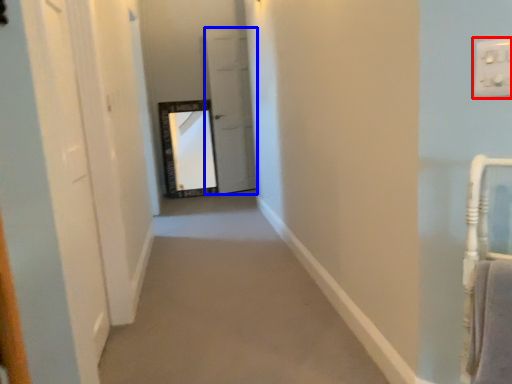
Question: Among these objects, which one is farthest to the camera, electric outlet (highlighted by a red box) or door (highlighted by a blue box)?

Choices:
 (A) electric outlet
 (B) door

Answer: (B)